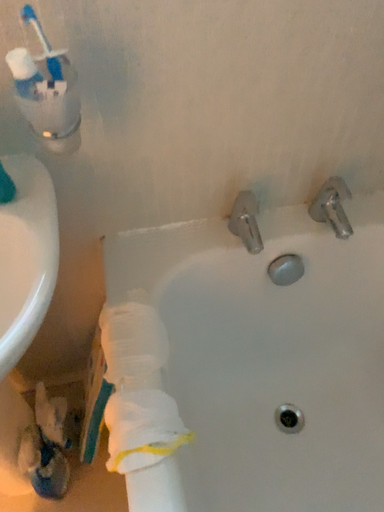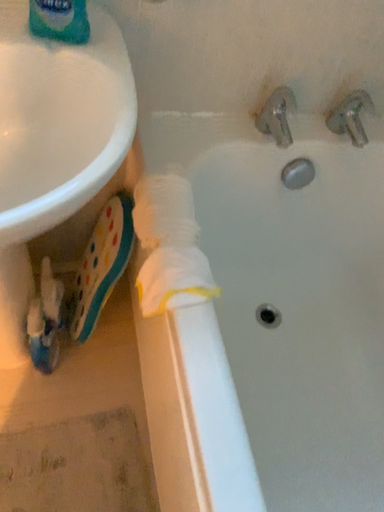
Question: Which way did the camera rotate in the video?

Choices:
 (A) rotated right
 (B) rotated left

Answer: (A)